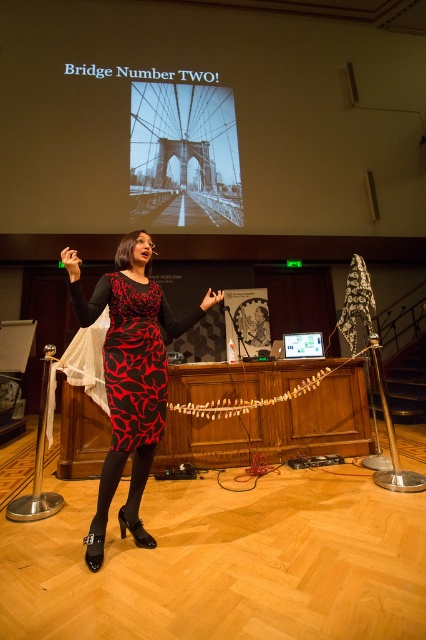
You are an event planner setting up a photo shoot in the lecture hall. You need to place a 3.5 inch wide decorative stand between the printed fabric dress at center and the black printed dress at center. Will there be enough space between them to fit the stand?

The printed fabric dress at center and black printed dress at center are 2.08 inches apart from each other. Since the decorative stand is 3.5 inches wide, it will not fit between them as the distance is smaller than the stand.